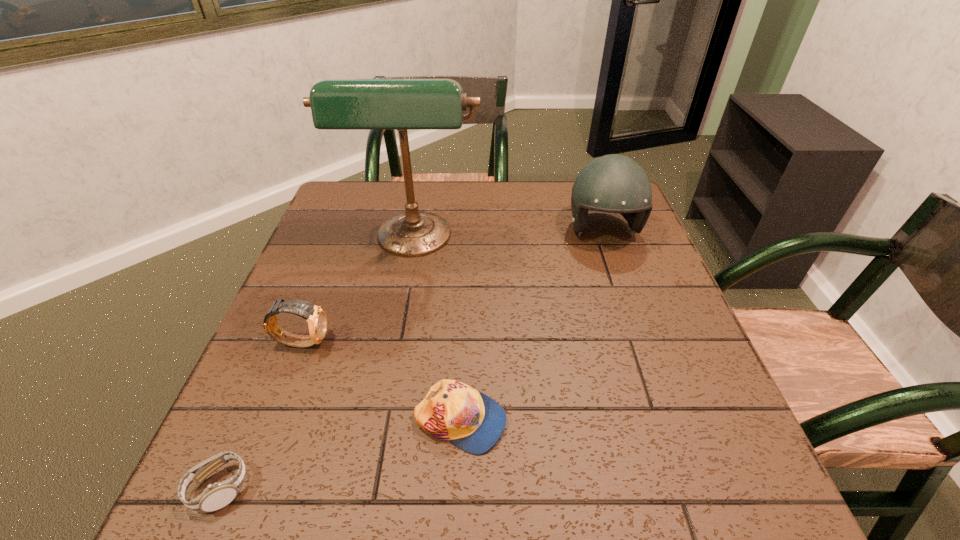
Locate an element on the screen. Image resolution: width=960 pixels, height=540 pixels. vacant area that lies between the second nearest object and the nearer watch is located at coordinates (340, 455).

Locate an element on the screen. The image size is (960, 540). vacant space in between the shortest object and the second tallest object is located at coordinates (411, 360).

This screenshot has width=960, height=540. Find the location of `unoccupied position between the shortest object and the farther watch`. unoccupied position between the shortest object and the farther watch is located at coordinates (260, 415).

Where is `free space between the nearest object and the fourth shortest object`? free space between the nearest object and the fourth shortest object is located at coordinates (411, 360).

This screenshot has width=960, height=540. What are the coordinates of `vacant area that lies between the table lamp and the rightmost object` in the screenshot? It's located at (509, 236).

Find the location of a particular element. The width and height of the screenshot is (960, 540). empty space that is in between the table lamp and the fourth shortest object is located at coordinates (509, 236).

Image resolution: width=960 pixels, height=540 pixels. I want to click on vacant space that is in between the shorter watch and the second tallest object, so click(x=411, y=360).

In order to click on object that is the closest to the cap in this screenshot , I will do `click(316, 317)`.

Image resolution: width=960 pixels, height=540 pixels. I want to click on object that can be found as the second closest to the table lamp, so click(613, 183).

At what (x,y) coordinates should I click in order to perform the action: click on free space in the image that satisfies the following two spatial constraints: 1. above the green lampshade of the tallest object; 2. on the face of the third shortest object. Please return your answer as a coordinate pair (x, y). Image resolution: width=960 pixels, height=540 pixels. Looking at the image, I should click on (396, 342).